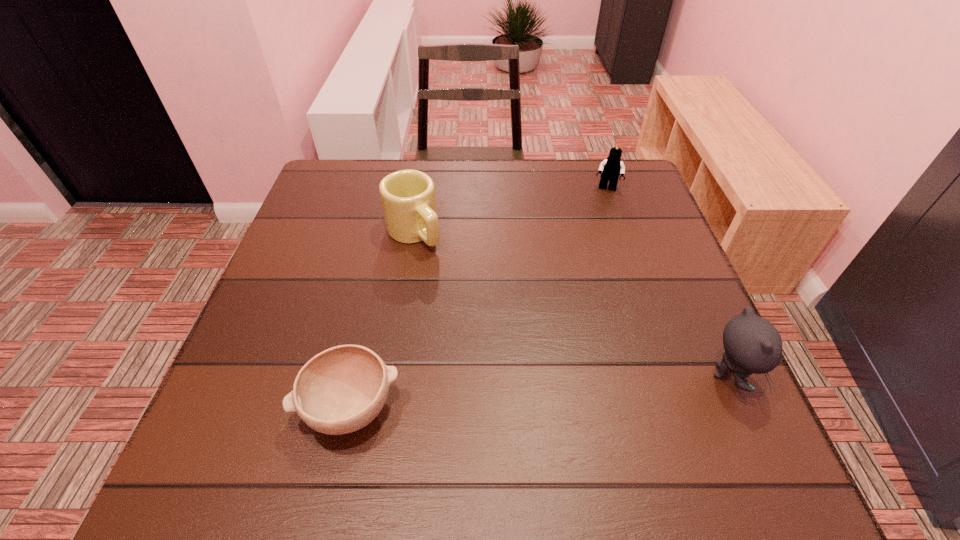
The image size is (960, 540). Identify the location of object that is at the near right corner. (752, 344).

At what (x,y) coordinates should I click in order to perform the action: click on vacant space at the far edge of the desktop. Please return your answer as a coordinate pair (x, y). Looking at the image, I should click on (558, 174).

Image resolution: width=960 pixels, height=540 pixels. In the image, there is a desktop. Find the location of `vacant space at the near edge`. vacant space at the near edge is located at coordinates click(x=641, y=422).

This screenshot has height=540, width=960. In the image, there is a desktop. Find the location of `vacant region at the left edge`. vacant region at the left edge is located at coordinates (305, 235).

In the image, there is a desktop. Where is `vacant space at the right edge`? vacant space at the right edge is located at coordinates (635, 236).

Identify the location of blank space at the far left corner of the desktop. Image resolution: width=960 pixels, height=540 pixels. (378, 169).

This screenshot has width=960, height=540. In the image, there is a desktop. What are the coordinates of `free region at the far right corner` in the screenshot? It's located at (597, 206).

You are a GUI agent. You are given a task and a screenshot of the screen. Output one action in this format:
    pyautogui.click(x=<x>, y=<y>)
    Task: Click on the free space at the near right corner of the desktop
    
    Given the screenshot: What is the action you would take?
    pyautogui.click(x=653, y=417)

Find the location of `unoccupied position between the bowl and the farthest object`. unoccupied position between the bowl and the farthest object is located at coordinates (478, 299).

Locate an element on the screen. This screenshot has width=960, height=540. vacant space in between the second farthest object and the third object from left to right is located at coordinates (510, 211).